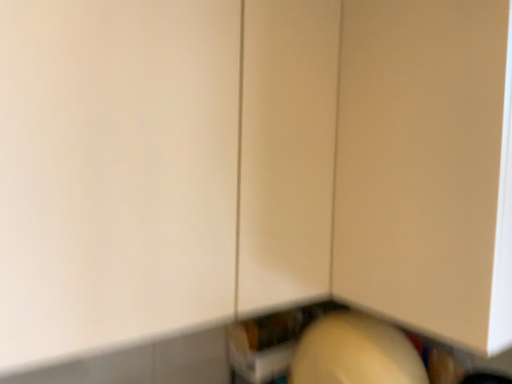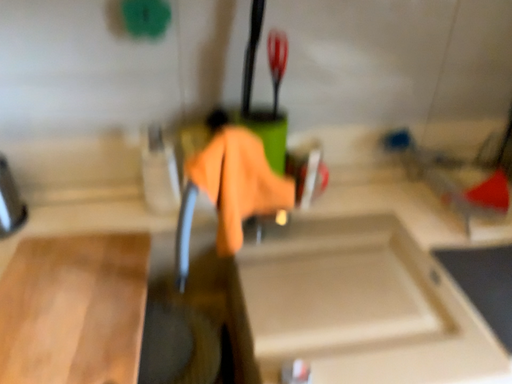
Question: How did the camera likely rotate when shooting the video?

Choices:
 (A) rotated left
 (B) rotated right

Answer: (A)